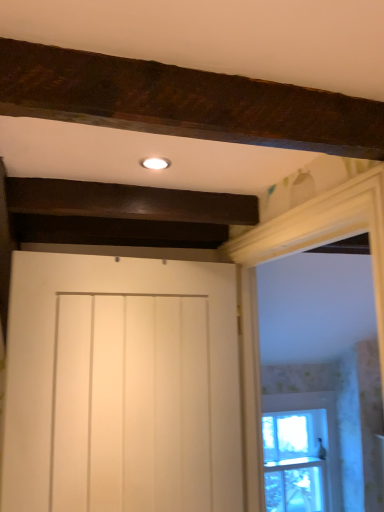
Question: Can you confirm if clear glass window at right is taller than white wood frame at upper right?

Choices:
 (A) no
 (B) yes

Answer: (A)

Question: Does clear glass window at right turn towards white wood frame at upper right?

Choices:
 (A) yes
 (B) no

Answer: (B)

Question: Is clear glass window at right in contact with white wood frame at upper right?

Choices:
 (A) yes
 (B) no

Answer: (B)

Question: Considering the relative sizes of clear glass window at right and white wood frame at upper right in the image provided, is clear glass window at right shorter than white wood frame at upper right?

Choices:
 (A) no
 (B) yes

Answer: (B)

Question: Is clear glass window at right behind white wood frame at upper right?

Choices:
 (A) yes
 (B) no

Answer: (A)

Question: In the image, is white matte door at center on the left side or the right side of clear glass window at right?

Choices:
 (A) left
 (B) right

Answer: (A)

Question: From the image's perspective, relative to clear glass window at right, is white matte door at center above or below?

Choices:
 (A) below
 (B) above

Answer: (B)

Question: Is point (107, 260) positioned closer to the camera than point (289, 431)?

Choices:
 (A) closer
 (B) farther

Answer: (A)

Question: Considering the positions of white matte door at center and clear glass window at right in the image, is white matte door at center bigger or smaller than clear glass window at right?

Choices:
 (A) big
 (B) small

Answer: (A)

Question: Is clear glass window at right taller or shorter than white matte door at center?

Choices:
 (A) tall
 (B) short

Answer: (B)

Question: Which is correct: clear glass window at right is inside white matte door at center, or outside of it?

Choices:
 (A) outside
 (B) inside

Answer: (A)

Question: Is clear glass window at right to the left or to the right of white matte door at center in the image?

Choices:
 (A) left
 (B) right

Answer: (B)

Question: In terms of width, does clear glass window at right look wider or thinner when compared to white matte door at center?

Choices:
 (A) thin
 (B) wide

Answer: (A)

Question: From a real-world perspective, relative to white matte door at center, is white wood frame at upper right vertically above or below?

Choices:
 (A) below
 (B) above

Answer: (B)

Question: Is white wood frame at upper right bigger or smaller than white matte door at center?

Choices:
 (A) big
 (B) small

Answer: (A)